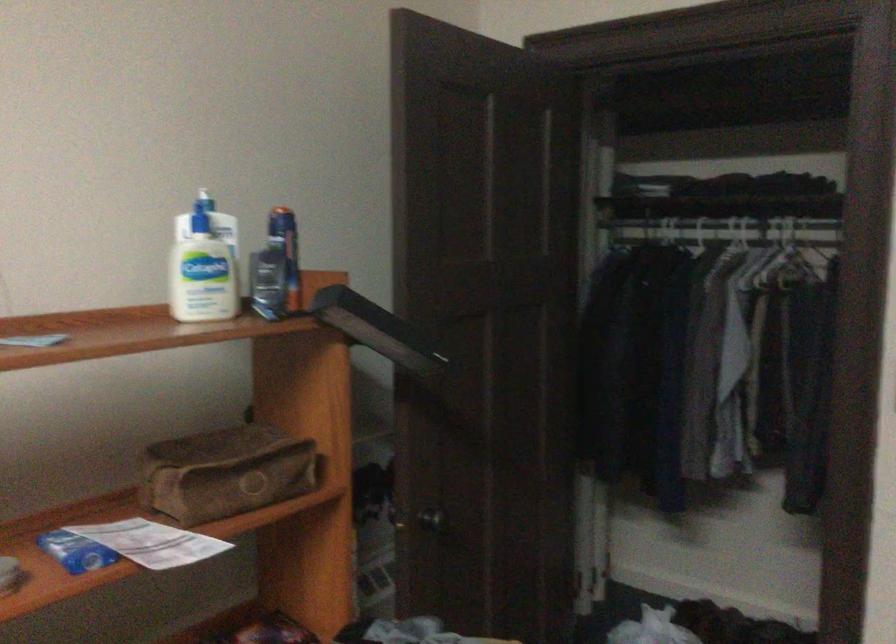
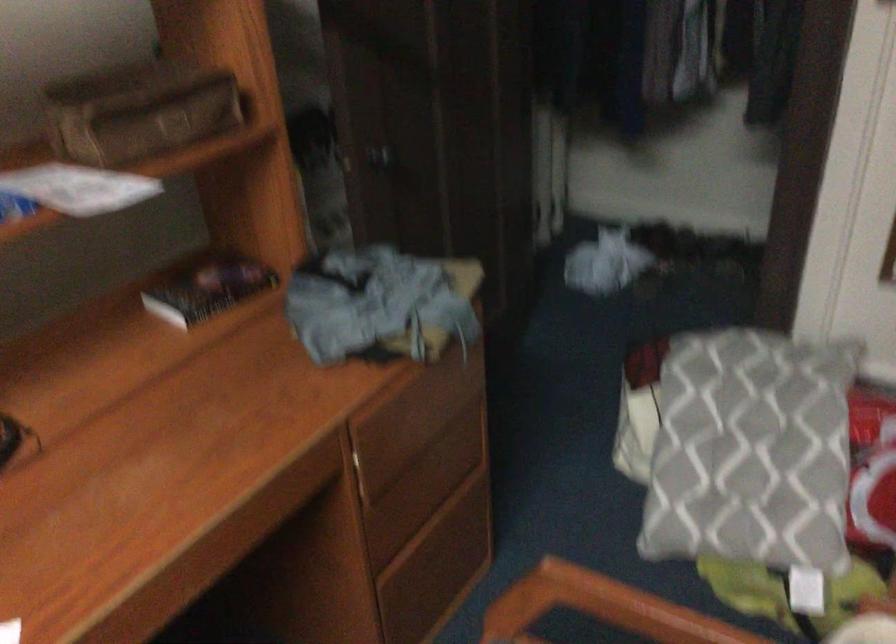
Question: The first image is from the beginning of the video and the second image is from the end. How did the camera likely rotate when shooting the video?

Choices:
 (A) Left
 (B) Right
 (C) Up
 (D) Down

Answer: (D)